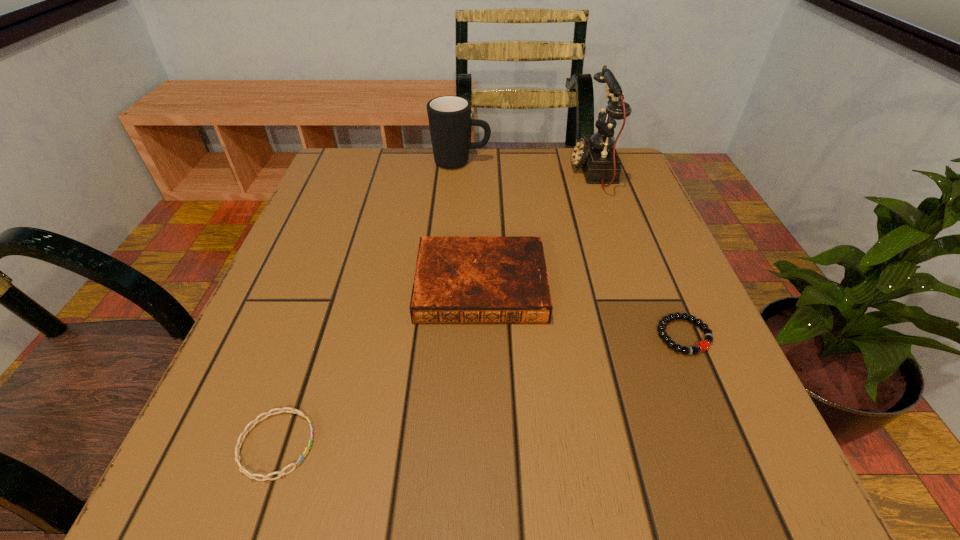
Locate an element on the screen. Image resolution: width=960 pixels, height=540 pixels. the tallest object is located at coordinates (595, 155).

Find the location of a particular element. mug is located at coordinates (449, 117).

Find the location of a particular element. Image resolution: width=960 pixels, height=540 pixels. the third tallest object is located at coordinates (458, 279).

Where is `the right bracelet`? the right bracelet is located at coordinates (703, 345).

You are a GUI agent. You are given a task and a screenshot of the screen. Output one action in this format:
    pyautogui.click(x=<x>, y=<y>)
    Task: Click on the leftmost object
    The width and height of the screenshot is (960, 540).
    Given the screenshot: What is the action you would take?
    pyautogui.click(x=242, y=469)

Identify the location of the nearest object. The width and height of the screenshot is (960, 540). (242, 469).

I want to click on vacant space located 0.080m on the dial of the tallest object, so click(x=539, y=171).

At what (x,y) coordinates should I click in order to perform the action: click on vacant space located 0.200m on the dial of the tallest object. Please return your answer as a coordinate pair (x, y). The width and height of the screenshot is (960, 540). Looking at the image, I should click on (489, 171).

Identify the location of vacant area situated 0.270m on the dial of the tallest object. (460, 171).

This screenshot has width=960, height=540. What are the coordinates of `vacant region located on the side of the fourth shortest object with the handle` in the screenshot? It's located at (624, 162).